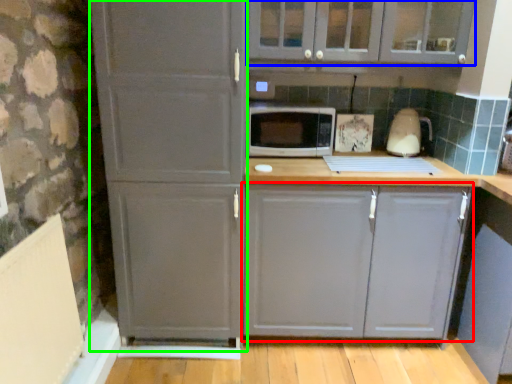
Question: Which object is the closest to the cabinetry (highlighted by a red box)? Choose among these: cabinetry (highlighted by a blue box) or screen door (highlighted by a green box).

Choices:
 (A) cabinetry
 (B) screen door

Answer: (B)